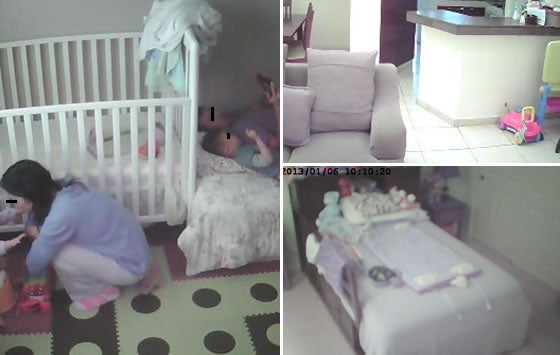
At what (x,y) coordinates should I click in order to perform the action: click on crib. Please return your answer as a coordinate pair (x, y). Looking at the image, I should click on (169, 161).